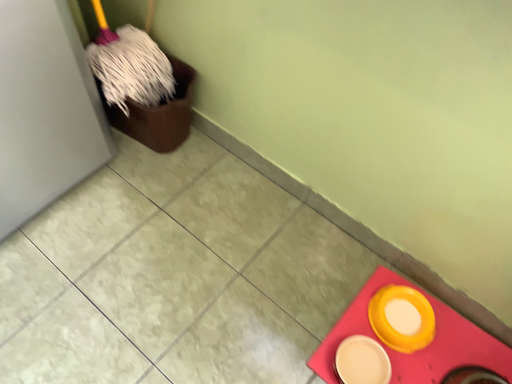
The height and width of the screenshot is (384, 512). Find the location of `vacant space situated on the left part of matte yellow bowl at lower right`. vacant space situated on the left part of matte yellow bowl at lower right is located at coordinates (271, 306).